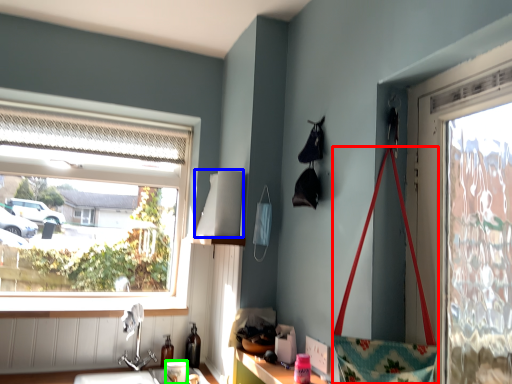
Question: Which is nearer to the handbag (highlighted by a red box)? lampshade (highlighted by a blue box) or coffee cup (highlighted by a green box).

Choices:
 (A) lampshade
 (B) coffee cup

Answer: (A)